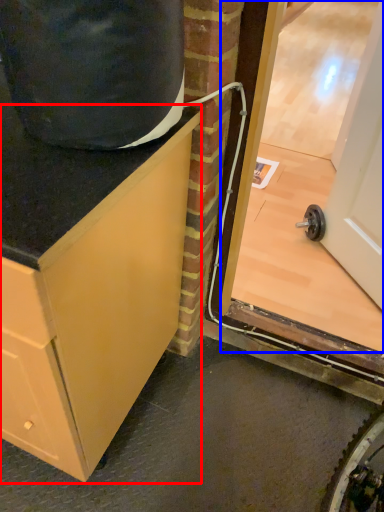
Question: Among these objects, which one is farthest to the camera, cabinetry (highlighted by a red box) or glass door (highlighted by a blue box)?

Choices:
 (A) cabinetry
 (B) glass door

Answer: (B)